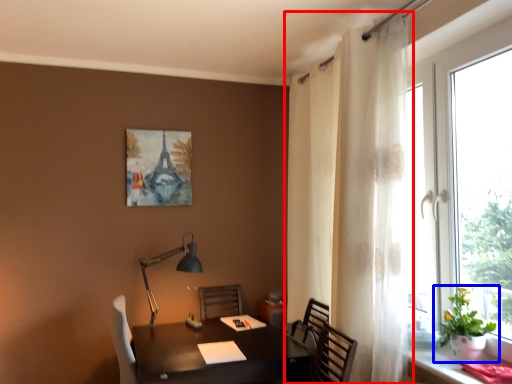
Question: Among these objects, which one is nearest to the camera, curtain (highlighted by a red box) or houseplant (highlighted by a blue box)?

Choices:
 (A) curtain
 (B) houseplant

Answer: (B)